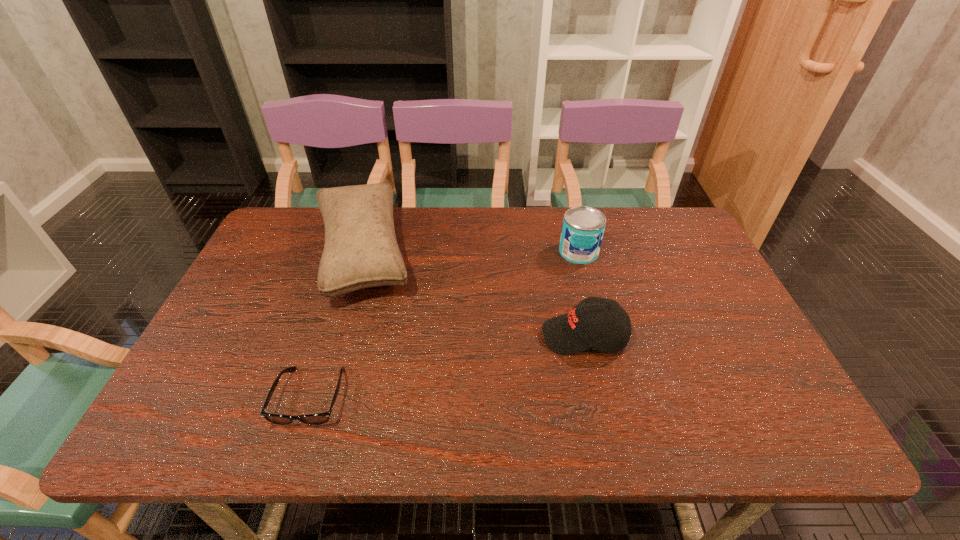
I want to click on empty space between the nearest object and the baseball cap, so click(447, 367).

Find the location of a particular element. The width and height of the screenshot is (960, 540). free space between the baseball cap and the spectacles is located at coordinates (447, 367).

Locate an element on the screen. free space that is in between the shortest object and the can is located at coordinates (444, 325).

Where is `unoccupied position between the baseball cap and the cushion`? Image resolution: width=960 pixels, height=540 pixels. unoccupied position between the baseball cap and the cushion is located at coordinates (473, 295).

You are a GUI agent. You are given a task and a screenshot of the screen. Output one action in this format:
    pyautogui.click(x=<x>, y=<y>)
    Task: Click on the unoccupied area between the can and the tallest object
    
    Given the screenshot: What is the action you would take?
    pyautogui.click(x=470, y=253)

Find the location of a particular element. The width and height of the screenshot is (960, 540). free space between the second shortest object and the shortest object is located at coordinates (447, 367).

In order to click on free space between the cushion and the nearest object in this screenshot , I will do `click(336, 325)`.

Locate an element on the screen. The height and width of the screenshot is (540, 960). empty space that is in between the spectacles and the tallest object is located at coordinates (336, 325).

Where is `unoccupied position between the can and the tallest object`? unoccupied position between the can and the tallest object is located at coordinates (470, 253).

Point out which object is positioned as the second nearest to the cushion. Please provide its 2D coordinates. Your answer should be formatted as a tuple, i.e. [(x, y)], where the tuple contains the x and y coordinates of a point satisfying the conditions above.

[(609, 329)]